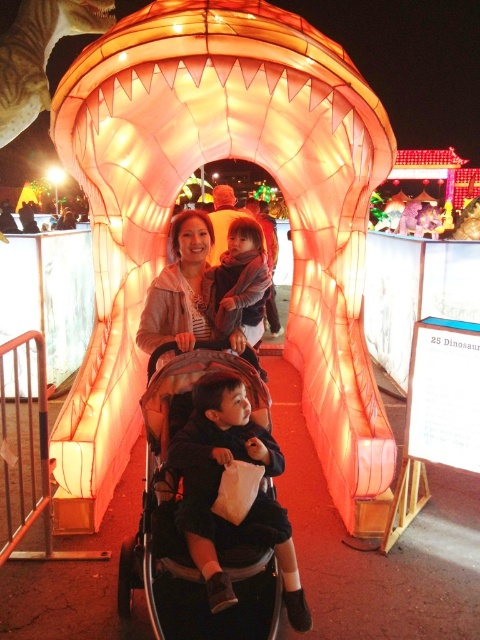
You are standing in the middle of the dinosaur mouth structure and want to move towards the closest point between the two points labeled point [239,326] and point [263,243]. Which point should you walk towards?

You should walk towards point [239,326] because it is closer to you than point [263,243].